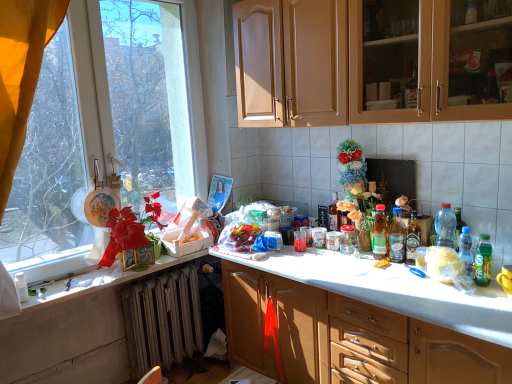
This screenshot has height=384, width=512. In order to click on free space on the front side of translucent plastic bottle at right, marked as the fifth bottle in a back-to-front arrangement in this screenshot , I will do `click(477, 289)`.